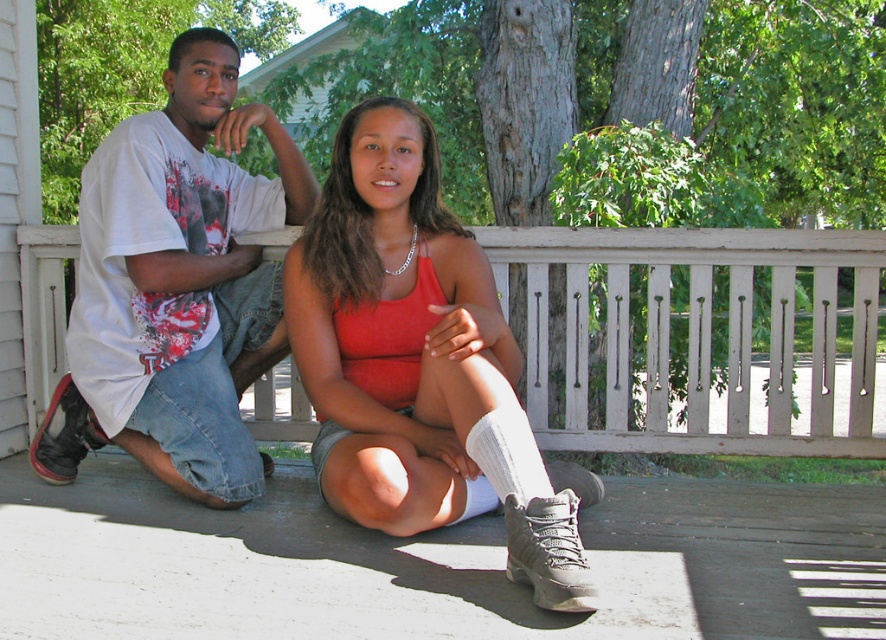
Does matte red tank top at center appear on the right side of white cotton t-shirt at left?

Correct, you'll find matte red tank top at center to the right of white cotton t-shirt at left.

Is point (479, 320) behind point (228, 353)?

No, (479, 320) is closer to viewer.

Image resolution: width=886 pixels, height=640 pixels. What do you see at coordinates (417, 360) in the screenshot? I see `matte red tank top at center` at bounding box center [417, 360].

Locate an element on the screen. matte red tank top at center is located at coordinates coord(417,360).

Who is more distant from viewer, [850,403] or [333,394]?

Positioned behind is point [850,403].

Is white wooden porch at center bigger than matte red tank top at center?

Correct, white wooden porch at center is larger in size than matte red tank top at center.

Is point (758, 372) closer to viewer compared to point (459, 380)?

No, (758, 372) is further to viewer.

Identify the location of white wooden porch at center. This screenshot has height=640, width=886. (702, 337).

Which is in front, point (177, 312) or point (333, 500)?

Point (333, 500) is in front.

Between matte white t-shirt at left and matte red tank top at center, which one is positioned higher?

matte white t-shirt at left

Who is more distant from viewer, (x=162, y=253) or (x=410, y=211)?

The point (x=410, y=211) is more distant.

What are the coordinates of `matte white t-shirt at left` in the screenshot? It's located at (177, 285).